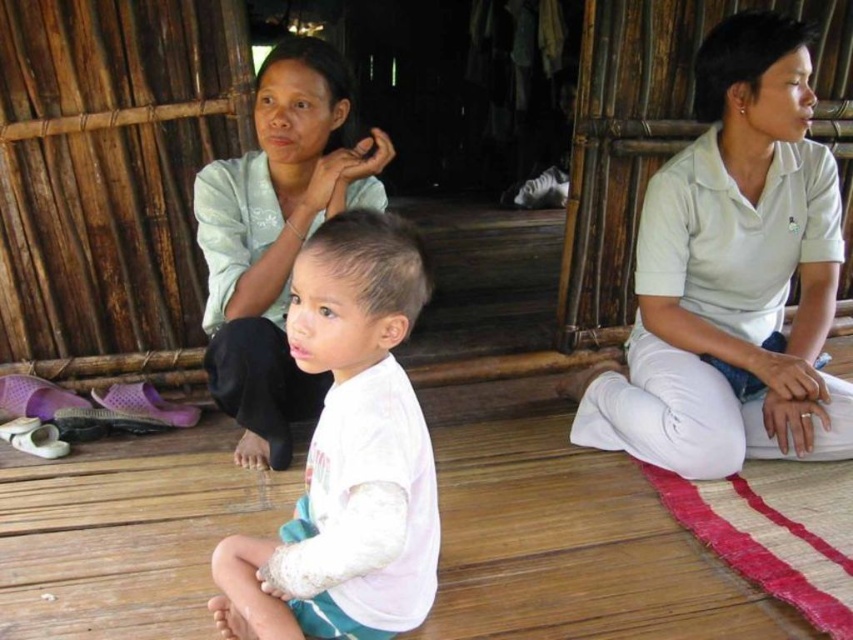
Question: Is white lace shirt at center thinner than matte light green blouse at center?

Choices:
 (A) yes
 (B) no

Answer: (A)

Question: Estimate the real-world distances between objects in this image. Which object is closer to the white lace shirt at center?

Choices:
 (A) white cotton shirt at center
 (B) matte light green blouse at center

Answer: (B)

Question: Estimate the real-world distances between objects in this image. Which object is closer to the white cotton shirt at center?

Choices:
 (A) white lace shirt at center
 (B) matte light green blouse at center

Answer: (B)

Question: In this image, where is white cotton shirt at center located relative to matte light green blouse at center?

Choices:
 (A) right
 (B) left

Answer: (A)

Question: Is white cotton shirt at center behind white lace shirt at center?

Choices:
 (A) no
 (B) yes

Answer: (B)

Question: Which of the following is the closest to the observer?

Choices:
 (A) (273, 406)
 (B) (328, 474)
 (C) (712, 401)

Answer: (B)